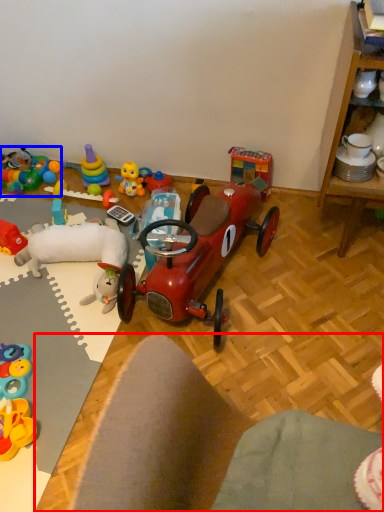
Question: Which object is closer to the camera taking this photo, desk (highlighted by a red box) or toy (highlighted by a blue box)?

Choices:
 (A) desk
 (B) toy

Answer: (A)